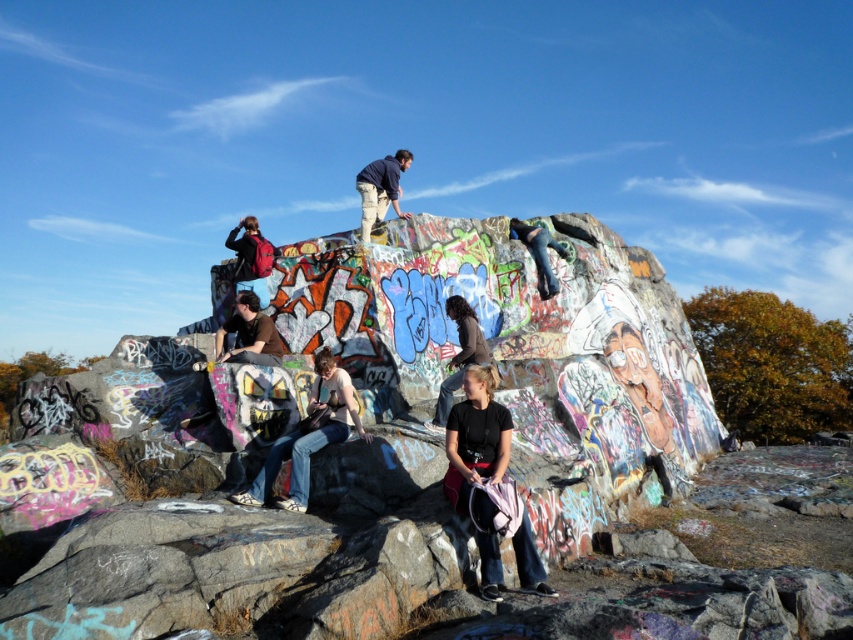
Question: Which point is closer to the camera?

Choices:
 (A) dark brown leather jacket at center
 (B) black matte shirt at center
 (C) dark blue shirt at upper center

Answer: (B)

Question: Which of the following is the farthest from the observer?

Choices:
 (A) (453, 438)
 (B) (231, 278)
 (C) (492, 358)
 (D) (372, 195)

Answer: (D)

Question: Where is denim jeans at center located in relation to blue jeans at upper center in the image?

Choices:
 (A) above
 (B) below

Answer: (B)

Question: Does black matte shirt at center appear on the right side of brown matte shirt at center?

Choices:
 (A) yes
 (B) no

Answer: (A)

Question: From the image, what is the correct spatial relationship of brown matte shirt at center in relation to blue jeans at upper center?

Choices:
 (A) below
 (B) above

Answer: (A)

Question: Which object is closer to the camera taking this photo?

Choices:
 (A) denim jeans at center
 (B) dark blue shirt at upper center
 (C) matte red backpack at center
 (D) dark brown leather jacket at center

Answer: (A)